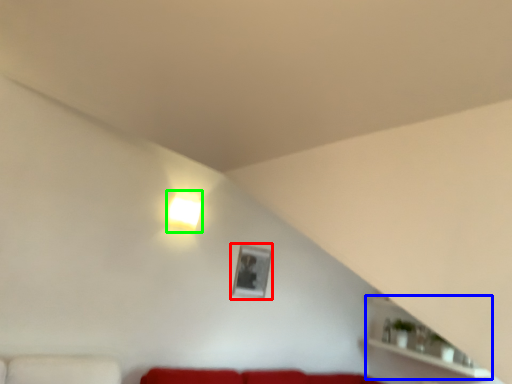
Question: Considering the real-world distances, which object is closest to picture frame (highlighted by a red box)? shelf (highlighted by a blue box) or lamp (highlighted by a green box).

Choices:
 (A) shelf
 (B) lamp

Answer: (B)